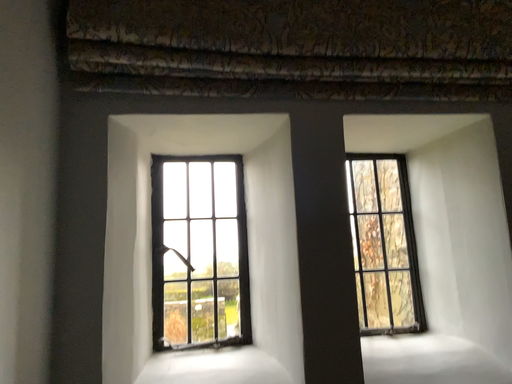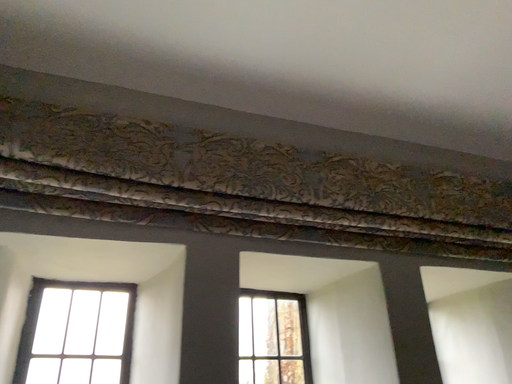
Question: How did the camera likely rotate when shooting the video?

Choices:
 (A) rotated right
 (B) rotated left

Answer: (A)